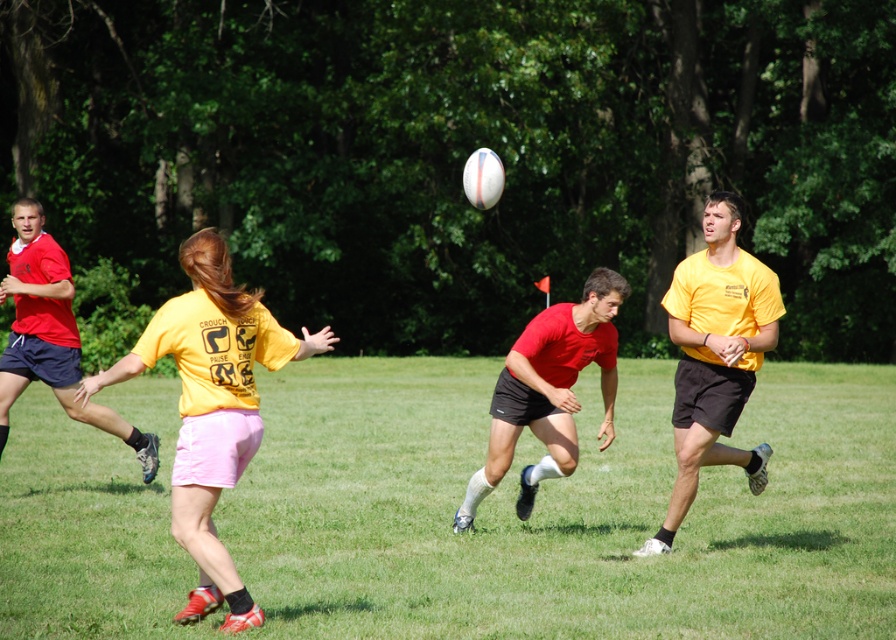
You are a referee observing the game. You notice the yellow matte shirt at center and the matte red shorts at center. Which one is positioned higher in the image?

The yellow matte shirt at center is located above the matte red shorts at center, so it is positioned higher in the image.

You are a referee observing the game. You notice the yellow matte shirt at right and the matte red shorts at center. Which object is positioned higher in the image?

The yellow matte shirt at right is positioned higher than the matte red shorts at center in the image.

You are a referee in a touch rugby match. You need to ensure that the players maintain a minimum distance of 10 feet between each other during the game. You see the yellow matte shirt at center and the yellow matte shirt at right. Can you confirm if they are maintaining the required distance?

The yellow matte shirt at center and the yellow matte shirt at right are 10.96 feet apart from each other, which exceeds the required 10 feet minimum distance. Therefore, they are maintaining the necessary separation.